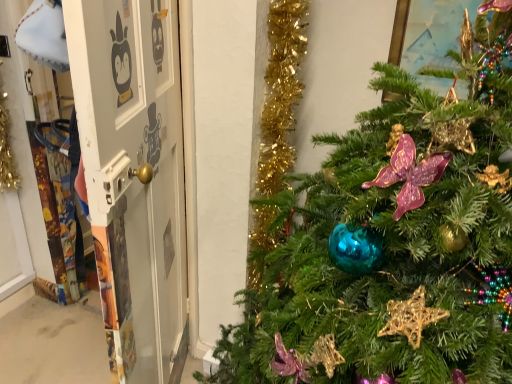
Question: Should I look upward or downward to see white glossy door at center?

Choices:
 (A) down
 (B) up

Answer: (B)

Question: Should I look upward or downward to see shiny teal ornament at center?

Choices:
 (A) down
 (B) up

Answer: (A)

Question: From the image's perspective, does white glossy door at center appear lower than shiny teal ornament at center?

Choices:
 (A) no
 (B) yes

Answer: (A)

Question: Is white glossy door at center at the right side of shiny teal ornament at center?

Choices:
 (A) no
 (B) yes

Answer: (A)

Question: Does white glossy door at center have a lesser height compared to shiny teal ornament at center?

Choices:
 (A) no
 (B) yes

Answer: (B)

Question: Does white glossy door at center lie in front of shiny teal ornament at center?

Choices:
 (A) no
 (B) yes

Answer: (A)

Question: Can you confirm if white glossy door at center is positioned to the left of shiny teal ornament at center?

Choices:
 (A) no
 (B) yes

Answer: (B)

Question: Does white glossy door at center have a lesser width compared to shiny teal ornament at center?

Choices:
 (A) yes
 (B) no

Answer: (A)

Question: Does shiny teal ornament at center have a greater height compared to white glossy door at center?

Choices:
 (A) no
 (B) yes

Answer: (B)

Question: Does shiny teal ornament at center have a smaller size compared to white glossy door at center?

Choices:
 (A) no
 (B) yes

Answer: (A)

Question: From the image's perspective, is shiny teal ornament at center over white glossy door at center?

Choices:
 (A) no
 (B) yes

Answer: (A)

Question: From a real-world perspective, is shiny teal ornament at center over white glossy door at center?

Choices:
 (A) yes
 (B) no

Answer: (A)

Question: Is shiny teal ornament at center positioned behind white glossy door at center?

Choices:
 (A) yes
 (B) no

Answer: (B)

Question: Considering the relative positions of shiny teal ornament at center and white glossy door at center in the image provided, is shiny teal ornament at center to the right of white glossy door at center from the viewer's perspective?

Choices:
 (A) no
 (B) yes

Answer: (B)

Question: Is shiny teal ornament at center situated inside white glossy door at center or outside?

Choices:
 (A) outside
 (B) inside

Answer: (A)